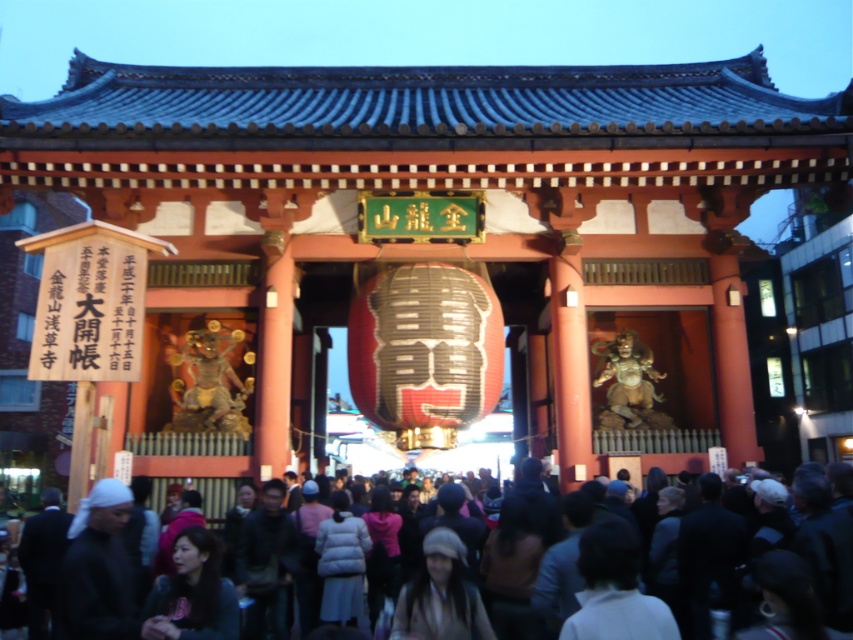
Can you confirm if dark clothing crowd at lower center is thinner than light brown hair at center?

No, dark clothing crowd at lower center is not thinner than light brown hair at center.

Between point (842, 513) and point (473, 614), which one is positioned in front?

Point (473, 614)

Locate an element on the screen. The height and width of the screenshot is (640, 853). dark clothing crowd at lower center is located at coordinates pyautogui.click(x=817, y=547).

Can you confirm if dark clothing crowd at lower center is taller than matte black hair at lower center?

Correct, dark clothing crowd at lower center is much taller as matte black hair at lower center.

Is dark clothing crowd at lower center above matte black hair at lower center?

Yes, dark clothing crowd at lower center is above matte black hair at lower center.

Based on the photo, who is more forward, (740,525) or (215,573)?

Point (215,573)

What are the coordinates of `dark clothing crowd at lower center` in the screenshot? It's located at (817, 547).

Who is higher up, matte black hair at lower center or light brown hair at center?

matte black hair at lower center is higher up.

Is point (209, 572) closer to viewer compared to point (474, 609)?

No, it is not.

The image size is (853, 640). I want to click on matte black hair at lower center, so click(192, 593).